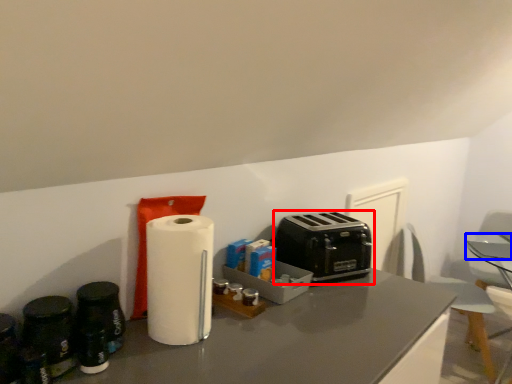
Question: Among these objects, which one is nearest to the camera, toaster (highlighted by a red box) or table (highlighted by a blue box)?

Choices:
 (A) toaster
 (B) table

Answer: (A)